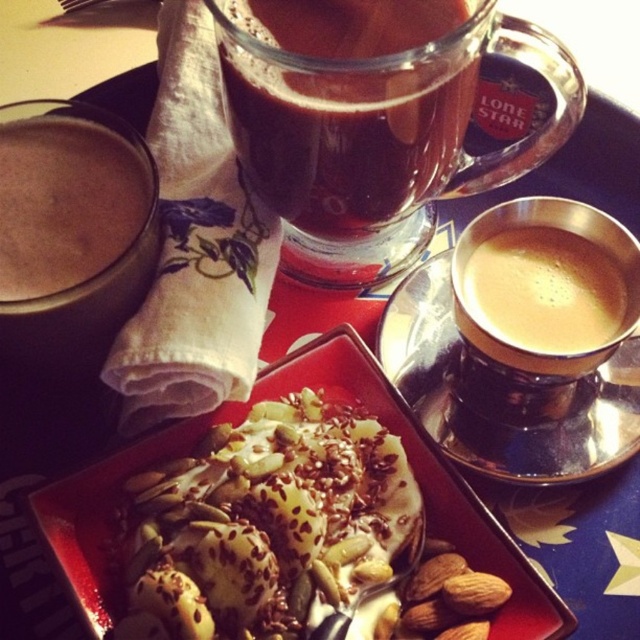
Question: From the image, what is the correct spatial relationship of white creamy dessert at center in relation to golden frothy coffee at right?

Choices:
 (A) right
 (B) left

Answer: (B)

Question: Is white creamy dessert at center positioned behind golden frothy coffee at right?

Choices:
 (A) no
 (B) yes

Answer: (A)

Question: Does transparent glass cup at upper center appear over matte brown coffee at left?

Choices:
 (A) no
 (B) yes

Answer: (B)

Question: Which is nearer to the matte brown coffee at left?

Choices:
 (A) golden frothy coffee at right
 (B) white creamy dessert at center

Answer: (B)

Question: Which point is farther from the camera taking this photo?

Choices:
 (A) (515, 92)
 (B) (45, 248)

Answer: (A)

Question: Which of the following is the closest to the observer?

Choices:
 (A) white creamy dessert at center
 (B) golden frothy coffee at right
 (C) transparent glass cup at upper center
 (D) matte brown coffee at left

Answer: (A)